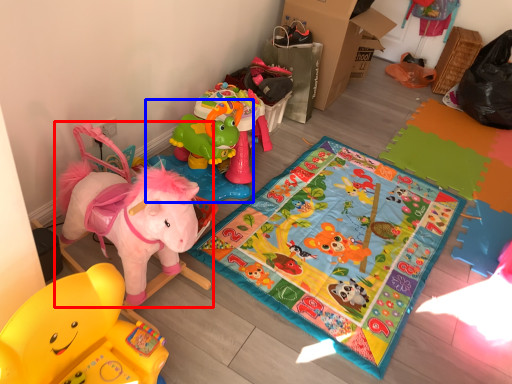
Question: Which object appears closest to the camera in this image, toy (highlighted by a red box) or toy (highlighted by a blue box)?

Choices:
 (A) toy
 (B) toy

Answer: (A)